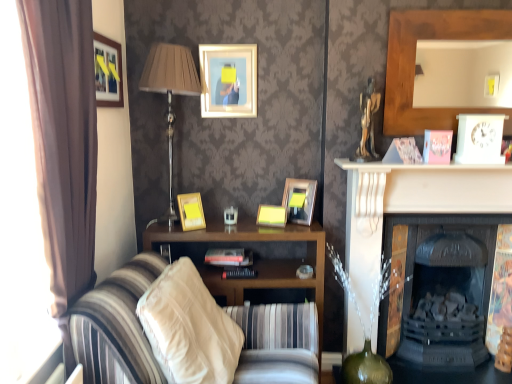
Question: Is striped fabric couch at center turned away from matte gold picture frame at center, the fifth picture frame positioned from the left?

Choices:
 (A) no
 (B) yes

Answer: (A)

Question: Can you confirm if striped fabric couch at center is thinner than matte gold picture frame at center, the fifth picture frame positioned from the left?

Choices:
 (A) yes
 (B) no

Answer: (B)

Question: Is striped fabric couch at center aimed at matte gold picture frame at center, which is the first picture frame from right to left?

Choices:
 (A) yes
 (B) no

Answer: (B)

Question: From a real-world perspective, is striped fabric couch at center below matte gold picture frame at center, which is the first picture frame from right to left?

Choices:
 (A) no
 (B) yes

Answer: (B)

Question: Is striped fabric couch at center not within matte gold picture frame at center, the fifth picture frame positioned from the left?

Choices:
 (A) yes
 (B) no

Answer: (A)

Question: Is striped fabric couch at center touching matte gold picture frame at center, the fifth picture frame positioned from the left?

Choices:
 (A) yes
 (B) no

Answer: (B)

Question: Is matte yellow picture frame at center, the 4th picture frame in the right-to-left sequence, touching matte gold picture frame at center, the fifth picture frame positioned from the left?

Choices:
 (A) yes
 (B) no

Answer: (B)

Question: Does matte yellow picture frame at center, positioned as the 2th picture frame in left-to-right order, contain matte gold picture frame at center, which is the first picture frame from right to left?

Choices:
 (A) no
 (B) yes

Answer: (A)

Question: Is matte yellow picture frame at center, positioned as the 2th picture frame in left-to-right order, oriented away from matte gold picture frame at center, which is the first picture frame from right to left?

Choices:
 (A) yes
 (B) no

Answer: (B)

Question: From a real-world perspective, is matte yellow picture frame at center, the 4th picture frame in the right-to-left sequence, over matte gold picture frame at center, which is the first picture frame from right to left?

Choices:
 (A) yes
 (B) no

Answer: (B)

Question: Is matte yellow picture frame at center, the 4th picture frame in the right-to-left sequence, far away from matte gold picture frame at center, which is the first picture frame from right to left?

Choices:
 (A) yes
 (B) no

Answer: (B)

Question: Does matte yellow picture frame at center, the 4th picture frame in the right-to-left sequence, turn towards matte gold picture frame at center, which is the first picture frame from right to left?

Choices:
 (A) yes
 (B) no

Answer: (B)

Question: Does yellow matte picture frame at center, the second picture frame positioned from the right, appear on the right side of beige fabric pillow at lower center?

Choices:
 (A) no
 (B) yes

Answer: (B)